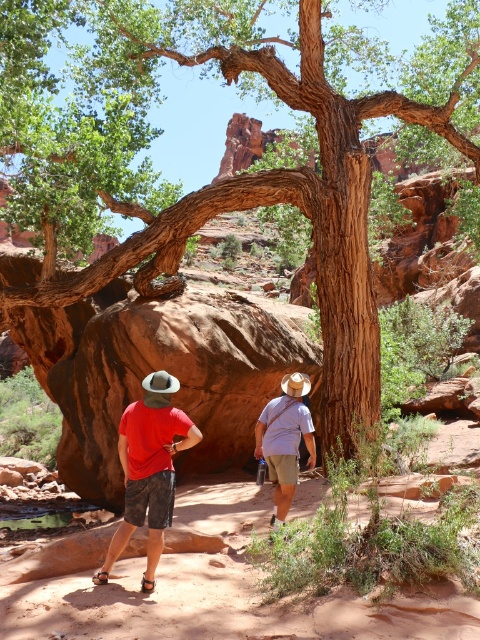
Can you confirm if camouflage shorts at center is thinner than matte red shirt at center?

No, camouflage shorts at center is not thinner than matte red shirt at center.

Which is in front, point (109, 550) or point (144, 579)?

Point (144, 579) is in front.

Describe the element at coordinates (148, 468) in the screenshot. I see `camouflage shorts at center` at that location.

Where is `camouflage shorts at center`? camouflage shorts at center is located at coordinates (148, 468).

Does matte red shirt at center have a smaller size compared to light blue cotton shirt at center?

Incorrect, matte red shirt at center is not smaller in size than light blue cotton shirt at center.

Is matte red shirt at center bigger than light blue cotton shirt at center?

Indeed, matte red shirt at center has a larger size compared to light blue cotton shirt at center.

What do you see at coordinates (148, 468) in the screenshot? I see `matte red shirt at center` at bounding box center [148, 468].

Identify the location of matte red shirt at center. The width and height of the screenshot is (480, 640). (148, 468).

Is camouflage shorts at center thinner than light blue cotton shirt at center?

Incorrect, camouflage shorts at center's width is not less than light blue cotton shirt at center's.

Who is lower down, camouflage shorts at center or light blue cotton shirt at center?

light blue cotton shirt at center is lower down.

Which is behind, point (121, 449) or point (298, 401)?

The point (298, 401) is behind.

Locate an element on the screen. This screenshot has width=480, height=640. camouflage shorts at center is located at coordinates (148, 468).